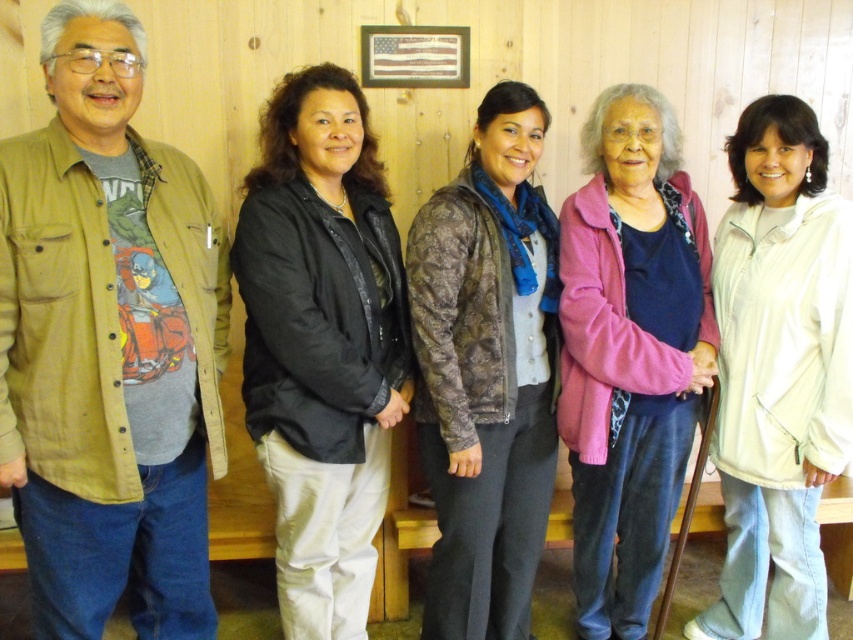
Question: Does black leather jacket at center appear on the left side of pink fabric jacket at center?

Choices:
 (A) no
 (B) yes

Answer: (B)

Question: Which of these objects is positioned farthest from the brown quilted jacket at center?

Choices:
 (A) black leather jacket at center
 (B) white matte jacket at center
 (C) pink fabric jacket at center

Answer: (B)

Question: Does brown quilted jacket at center appear over pink fabric jacket at center?

Choices:
 (A) no
 (B) yes

Answer: (B)

Question: Where is brown quilted jacket at center located in relation to white matte jacket at center in the image?

Choices:
 (A) left
 (B) right

Answer: (A)

Question: Which point is closer to the camera taking this photo?

Choices:
 (A) (283, 628)
 (B) (683, 330)

Answer: (A)

Question: Which point is farther to the camera?

Choices:
 (A) pink fabric jacket at center
 (B) white matte jacket at center
 (C) black leather jacket at center
 (D) brown quilted jacket at center

Answer: (A)